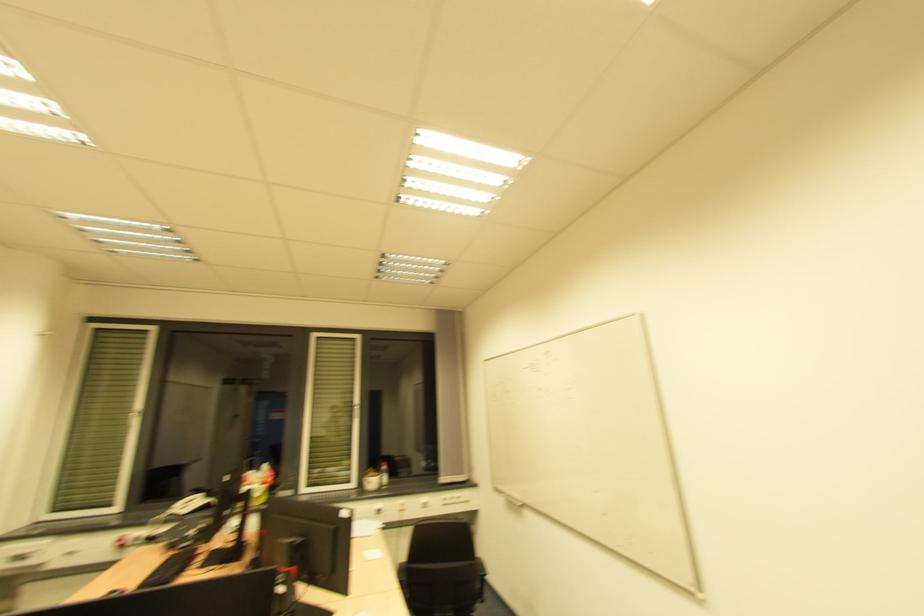
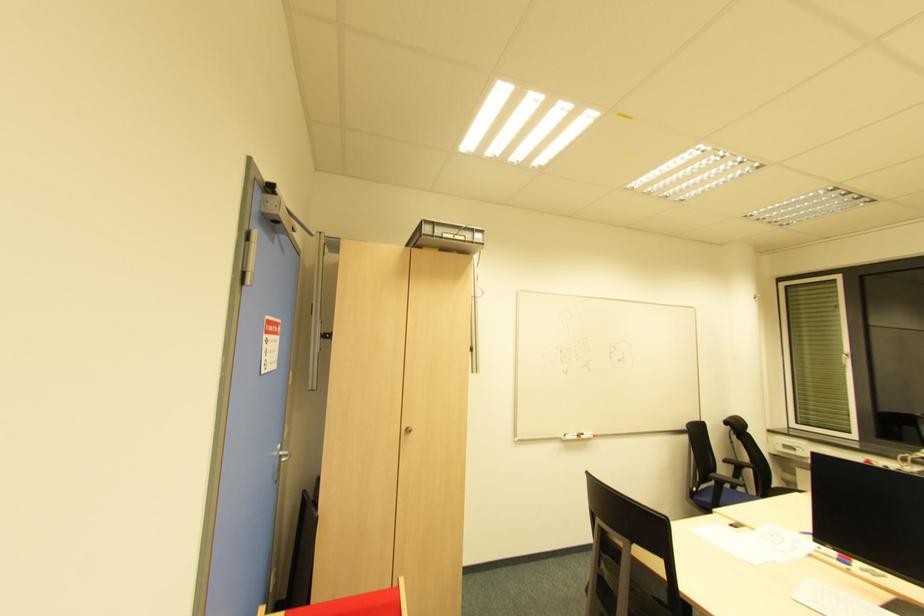
Question: The camera is either moving clockwise (left) or counter-clockwise (right) around the object. The first image is from the beginning of the video and the second image is from the end. Is the camera moving left or right when shooting the video?

Choices:
 (A) Left
 (B) Right

Answer: (B)